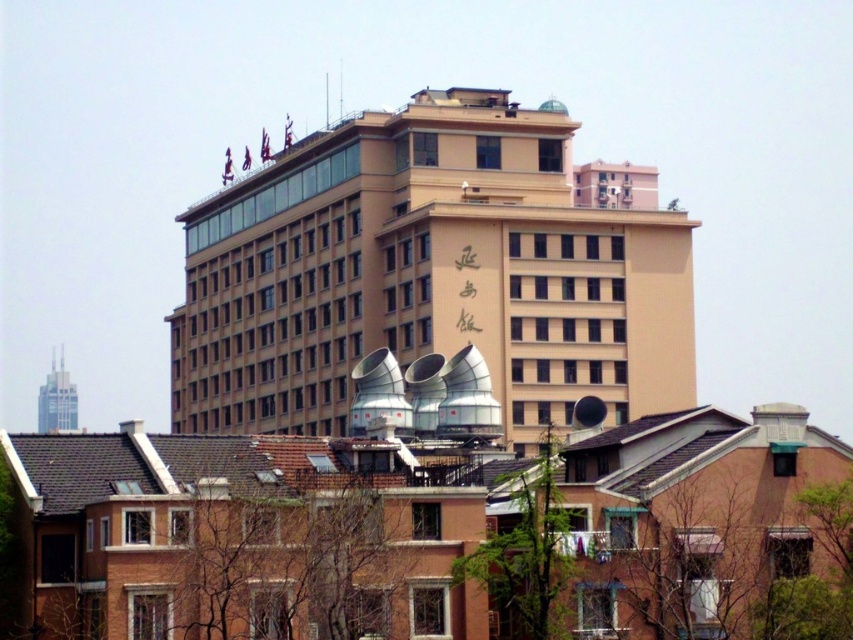
Is beige concrete building at center above glassy steel skyscraper at upper left?

Yes.

Which is below, beige concrete building at center or glassy steel skyscraper at upper left?

Positioned lower is glassy steel skyscraper at upper left.

The width and height of the screenshot is (853, 640). In order to click on beige concrete building at center in this screenshot , I will do `click(428, 275)`.